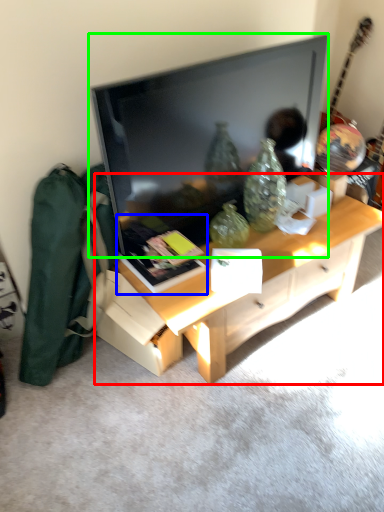
Question: Which is nearer to the desk (highlighted by a red box)? book (highlighted by a blue box) or television (highlighted by a green box).

Choices:
 (A) book
 (B) television

Answer: (A)